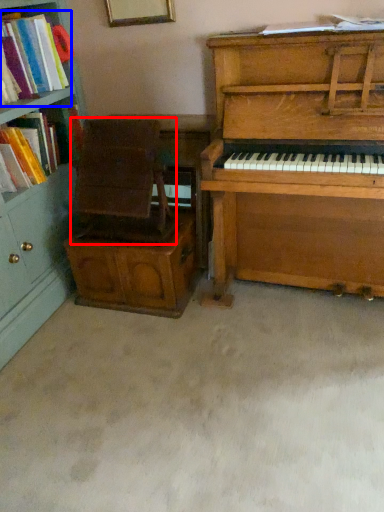
Question: Which of the following is the farthest to the observer, armchair (highlighted by a red box) or book (highlighted by a blue box)?

Choices:
 (A) armchair
 (B) book

Answer: (A)